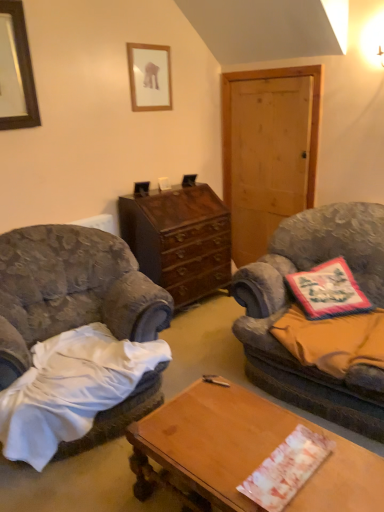
Question: Considering the relative sizes of white paper at center, acting as the first sheet starting from the bottom, and velvet gray armchair at left in the image provided, is white paper at center, acting as the first sheet starting from the bottom, thinner than velvet gray armchair at left?

Choices:
 (A) yes
 (B) no

Answer: (A)

Question: Is white paper at center, the 2th sheet from the top, oriented away from velvet gray armchair at left?

Choices:
 (A) yes
 (B) no

Answer: (B)

Question: Is velvet gray armchair at left inside white paper at center, acting as the first sheet starting from the bottom?

Choices:
 (A) yes
 (B) no

Answer: (B)

Question: Is white paper at center, acting as the first sheet starting from the bottom, further to camera compared to velvet gray armchair at left?

Choices:
 (A) no
 (B) yes

Answer: (A)

Question: Considering the relative sizes of white paper at center, the 2th sheet from the top, and velvet gray armchair at left in the image provided, is white paper at center, the 2th sheet from the top, taller than velvet gray armchair at left?

Choices:
 (A) no
 (B) yes

Answer: (A)

Question: Is orange fabric pillow at right, the second sheet positioned from the front, in front of or behind white paper at center, the 1th sheet viewed from the front, in the image?

Choices:
 (A) behind
 (B) front

Answer: (A)

Question: In terms of size, does orange fabric pillow at right, placed as the second sheet when sorted from bottom to top, appear bigger or smaller than white paper at center, the 1th sheet viewed from the front?

Choices:
 (A) big
 (B) small

Answer: (A)

Question: In terms of height, does orange fabric pillow at right, acting as the 1th sheet starting from the top, look taller or shorter compared to white paper at center, the 2th sheet from the top?

Choices:
 (A) tall
 (B) short

Answer: (A)

Question: From a real-world perspective, is orange fabric pillow at right, the second sheet positioned from the front, above or below white paper at center, the 2th sheet from the top?

Choices:
 (A) below
 (B) above

Answer: (B)

Question: Do you think black wooden picture frame at upper left, the first picture frame positioned from the left, is within wooden desk at center, or outside of it?

Choices:
 (A) outside
 (B) inside

Answer: (A)

Question: From a real-world perspective, is black wooden picture frame at upper left, the first picture frame positioned from the front, positioned above or below wooden desk at center?

Choices:
 (A) below
 (B) above

Answer: (B)

Question: Is black wooden picture frame at upper left, which is the second picture frame in back-to-front order, bigger or smaller than wooden desk at center?

Choices:
 (A) big
 (B) small

Answer: (B)

Question: In terms of height, does black wooden picture frame at upper left, the first picture frame positioned from the front, look taller or shorter compared to wooden desk at center?

Choices:
 (A) tall
 (B) short

Answer: (A)

Question: Considering the positions of floral fabric pillow at right and velvet gray armchair at left in the image, is floral fabric pillow at right bigger or smaller than velvet gray armchair at left?

Choices:
 (A) small
 (B) big

Answer: (A)

Question: Based on their positions, is floral fabric pillow at right located to the left or right of velvet gray armchair at left?

Choices:
 (A) right
 (B) left

Answer: (A)